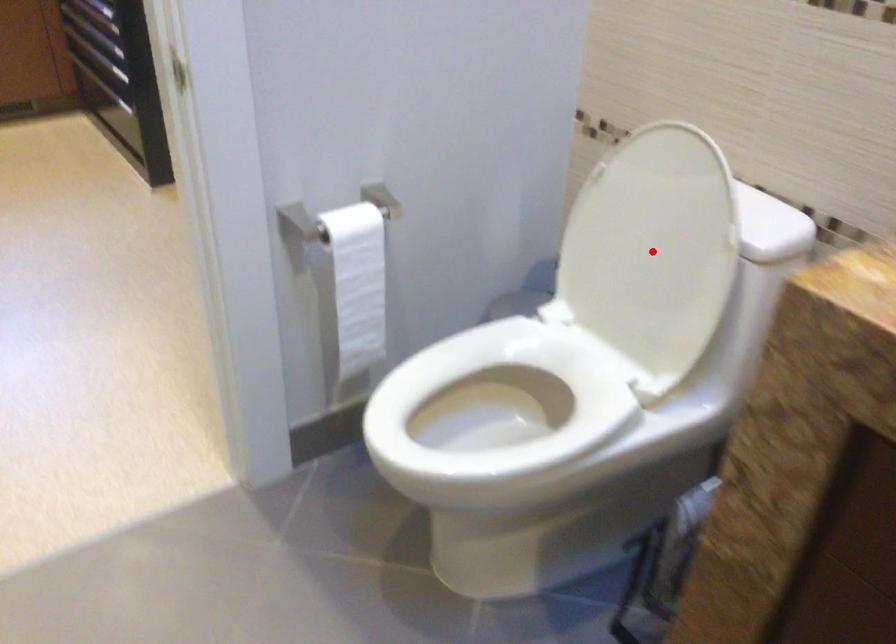
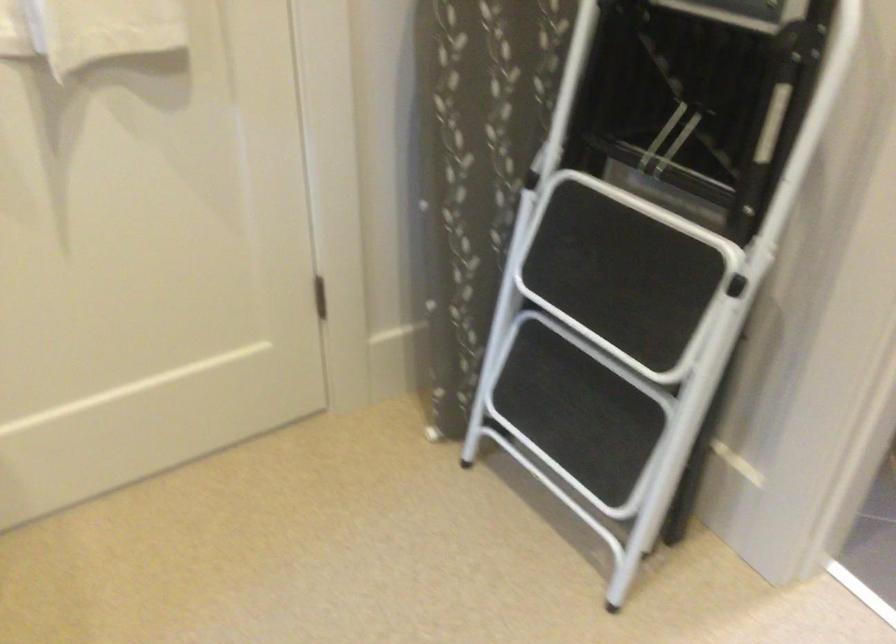
Question: I am providing you with two images of the same scene from different viewpoints. A red point is marked on the first image. At the location where the point appears in image 1, is it still visible in image 2?

Choices:
 (A) Yes
 (B) No

Answer: (B)